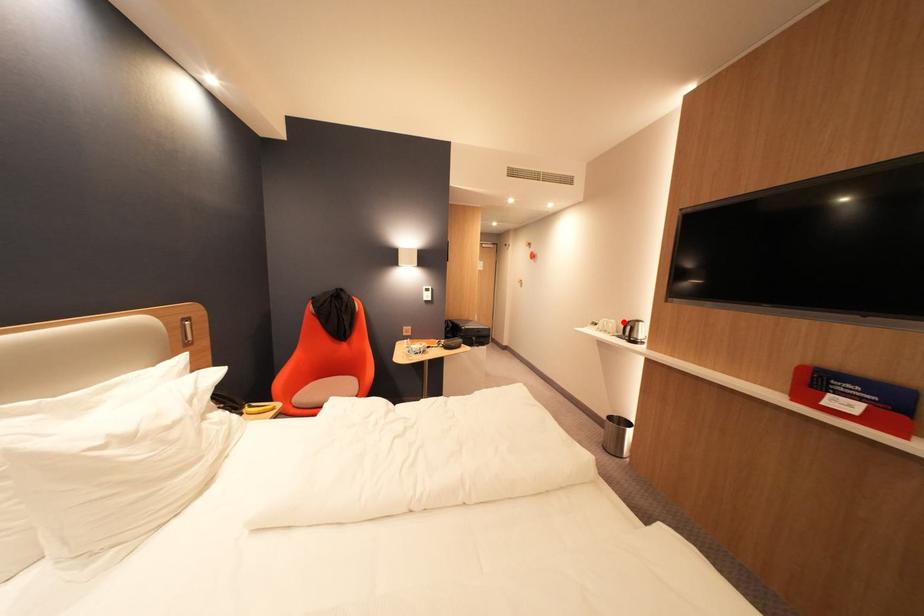
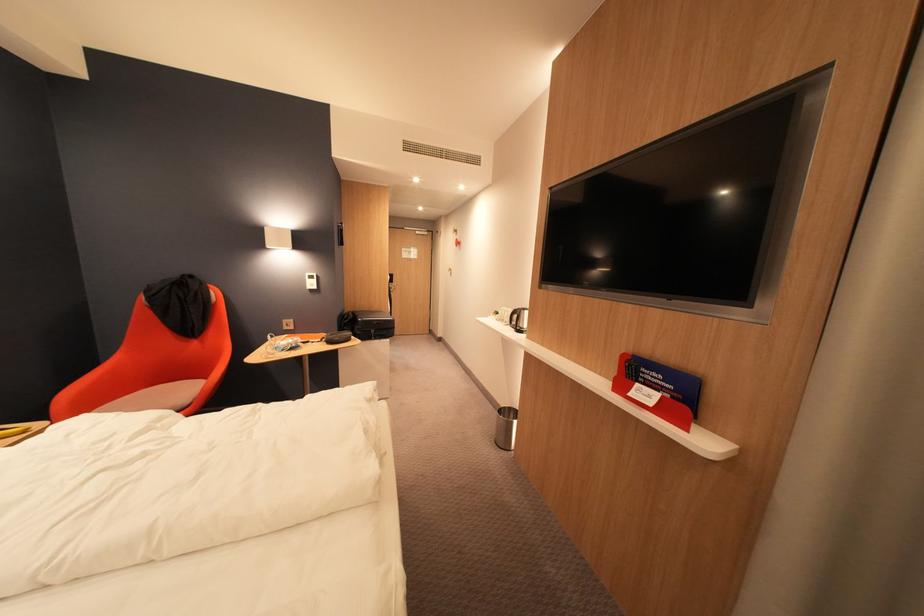
Find the pixel in the second image that matches the highlighted location in the first image.

(519, 310)